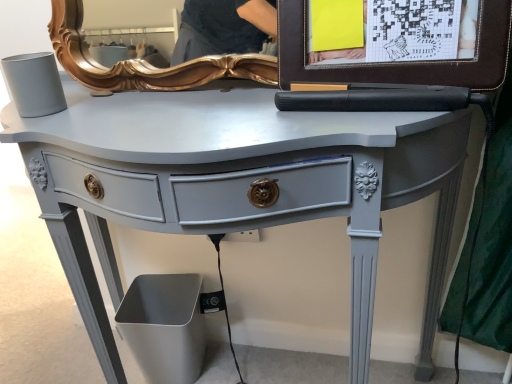
In order to click on brown leather picture frame at upper right in this screenshot , I will do `click(400, 62)`.

What is the approximate height of brown leather picture frame at upper right?

brown leather picture frame at upper right is 6.23 inches tall.

The image size is (512, 384). What do you see at coordinates (400, 62) in the screenshot?
I see `brown leather picture frame at upper right` at bounding box center [400, 62].

Find the location of `brown leather picture frame at upper right`. brown leather picture frame at upper right is located at coordinates (400, 62).